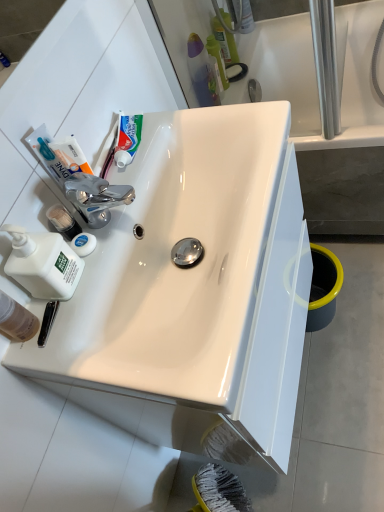
Question: From the image's perspective, is green matte toothpaste at upper center located beneath translucent plastic mouthwash at lower left?

Choices:
 (A) yes
 (B) no

Answer: (B)

Question: Is green matte toothpaste at upper center positioned with its back to translucent plastic mouthwash at lower left?

Choices:
 (A) no
 (B) yes

Answer: (A)

Question: Is green matte toothpaste at upper center directly adjacent to translucent plastic mouthwash at lower left?

Choices:
 (A) no
 (B) yes

Answer: (A)

Question: Does green matte toothpaste at upper center lie in front of translucent plastic mouthwash at lower left?

Choices:
 (A) yes
 (B) no

Answer: (B)

Question: Does green matte toothpaste at upper center have a larger size compared to translucent plastic mouthwash at lower left?

Choices:
 (A) no
 (B) yes

Answer: (A)

Question: From the image's perspective, is green matte toothpaste at upper center above translucent plastic mouthwash at lower left?

Choices:
 (A) no
 (B) yes

Answer: (B)

Question: Considering the relative sizes of translucent plastic toothbrush at upper center and white glossy sink at center in the image provided, is translucent plastic toothbrush at upper center thinner than white glossy sink at center?

Choices:
 (A) yes
 (B) no

Answer: (A)

Question: Can you confirm if translucent plastic toothbrush at upper center is positioned to the left of white glossy sink at center?

Choices:
 (A) yes
 (B) no

Answer: (B)

Question: Does translucent plastic toothbrush at upper center turn towards white glossy sink at center?

Choices:
 (A) yes
 (B) no

Answer: (B)

Question: Can you confirm if translucent plastic toothbrush at upper center is positioned to the right of white glossy sink at center?

Choices:
 (A) yes
 (B) no

Answer: (A)

Question: From a real-world perspective, is translucent plastic toothbrush at upper center on white glossy sink at center?

Choices:
 (A) yes
 (B) no

Answer: (B)

Question: Can you see translucent plastic toothbrush at upper center touching white glossy sink at center?

Choices:
 (A) yes
 (B) no

Answer: (B)

Question: Is the depth of green matte toothpaste at upper center less than that of white glossy bathtub at upper right?

Choices:
 (A) yes
 (B) no

Answer: (A)